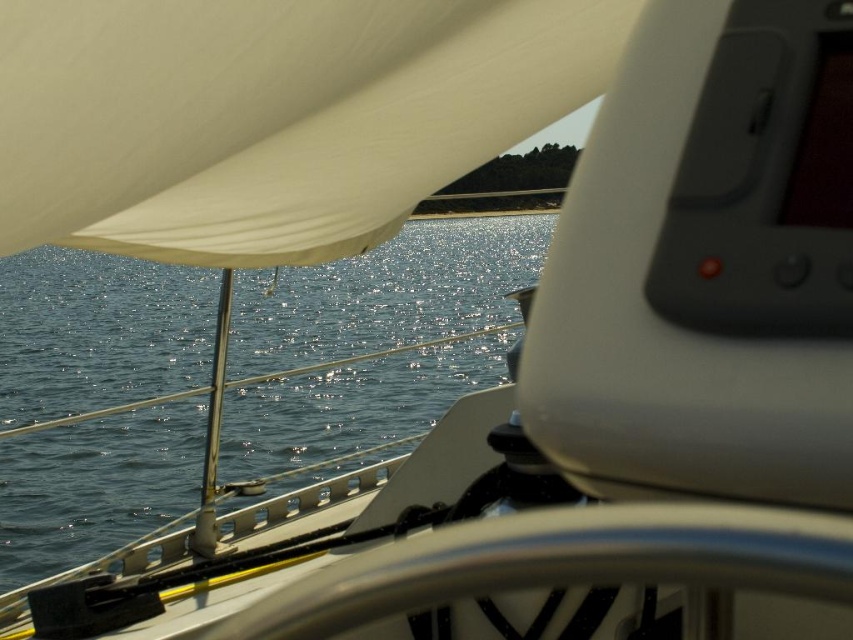
You are a sailor on a boat and need to secure a rope that is 10 meters long to the sail. The white matte sail at upper left is positioned above the glistening blue water at center. Can the rope reach from the sail to the water without touching the deck?

The white matte sail at upper left is 10.33 meters from the glistening blue water at center. Since the rope is 10 meters long, it may not be long enough to span the distance between the sail and the water without touching the deck.

You are standing on the deck of the sailboat and want to reach both the point at coordinates point (x=431, y=170) and point (x=537, y=230). Which point should you reach first if you move forward in the direction you are facing?

You should reach point (x=431, y=170) first because it is closer to you than point (x=537, y=230).

You are a sailor trying to determine the visibility of your sail against the water. Which object, the white matte sail at upper left or the glistening blue water at center, has a smaller width?

The white matte sail at upper left is thinner than the glistening blue water at center, so the white matte sail at upper left has a smaller width.